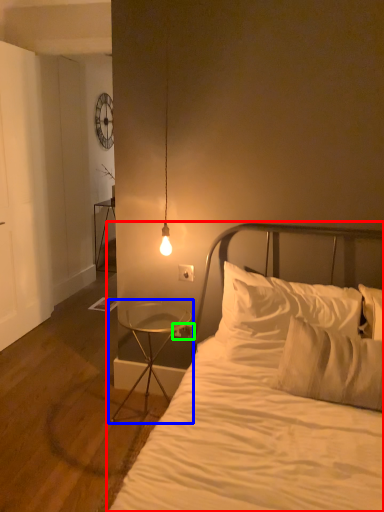
Question: Based on their relative distances, which object is nearer to bed (highlighted by a red box)? Choose from nightstand (highlighted by a blue box) and electric outlet (highlighted by a green box).

Choices:
 (A) nightstand
 (B) electric outlet

Answer: (A)